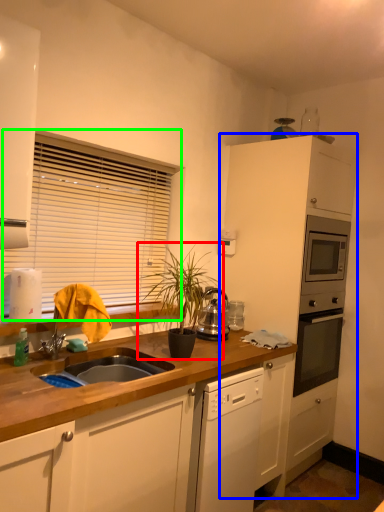
Question: Estimate the real-world distances between objects in this image. Which object is closer to houseplant (highlighted by a red box), cabinetry (highlighted by a blue box) or window blind (highlighted by a green box)?

Choices:
 (A) cabinetry
 (B) window blind

Answer: (B)